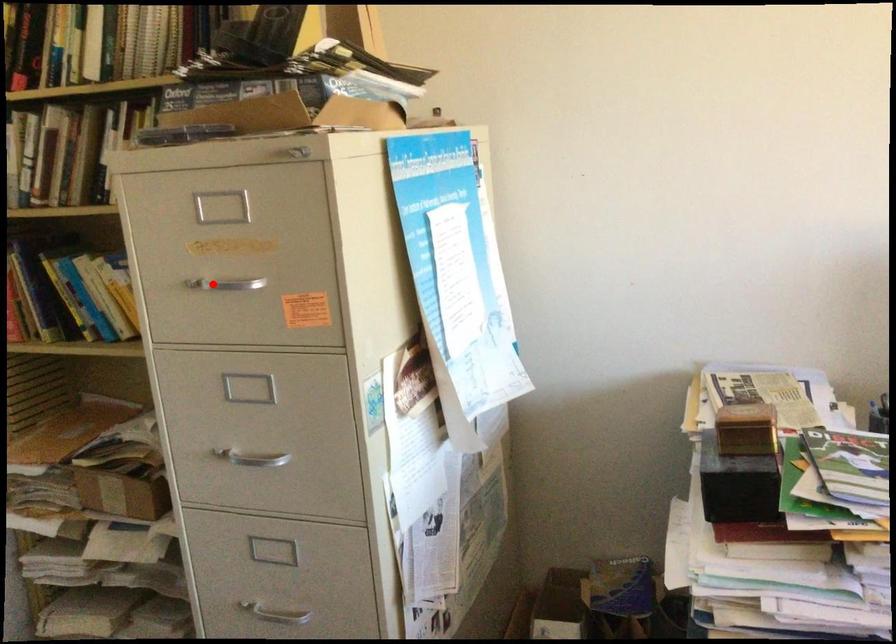
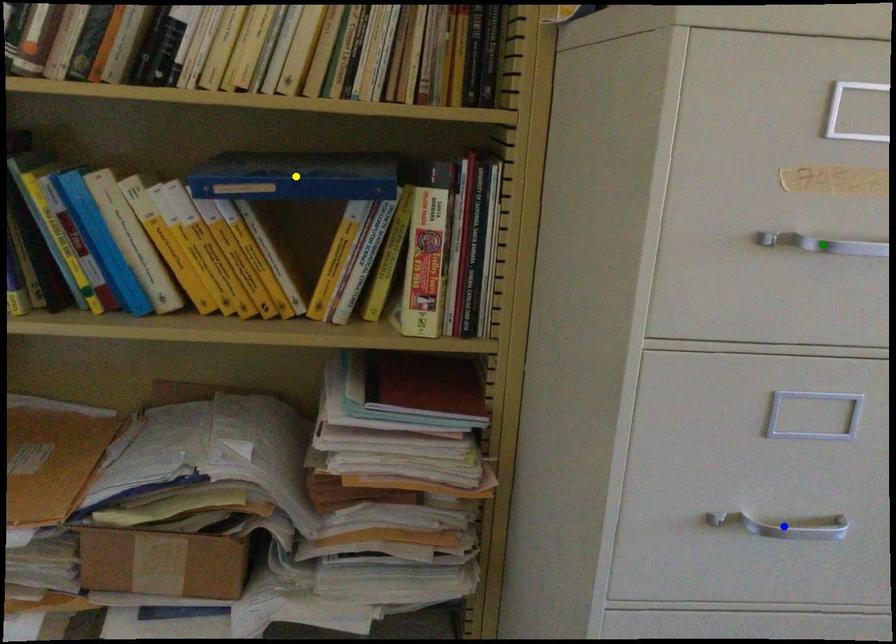
Question: I am providing you with two images of the same scene from different viewpoints. A red point is marked on the first image. You are given multiple points on the second image. Which point in image 2 represents the same 3d spot as the red point in image 1?

Choices:
 (A) yellow point
 (B) green point
 (C) blue point

Answer: (B)